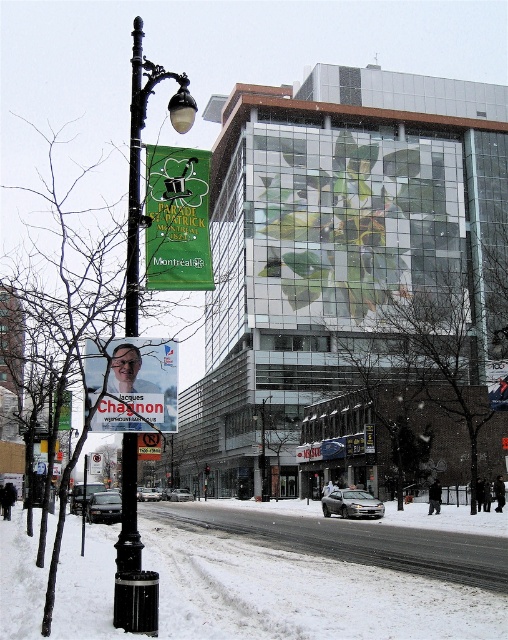
Consider the image. You are a delivery person standing at point (94,413) and need to deliver a package to point (193,177). According to the scene, which direction should you move relative to your current position?

Since point (193,177) is behind point (94,413), you should move backward to reach it.

You are a delivery drone flying over the snowy street scene. You need to drop off a package at the green fabric banner at upper left. According to the coordinates provided in the description, where exactly should you aim to deliver the package?

The green fabric banner at upper left is located at point (176, 220), so you should aim for those coordinates to deliver the package.

Looking at this image, you are a photographer trying to capture the entire scene in one shot. Given that the white snow at lower left and the green fabric banner at upper left are both in your frame, which object would you need to adjust your camera angle to include fully if you want to prioritize capturing the narrower one first?

The green fabric banner at upper left is narrower than the white snow at lower left, so you should adjust your camera angle to include the green fabric banner at upper left first since it is the narrower object.